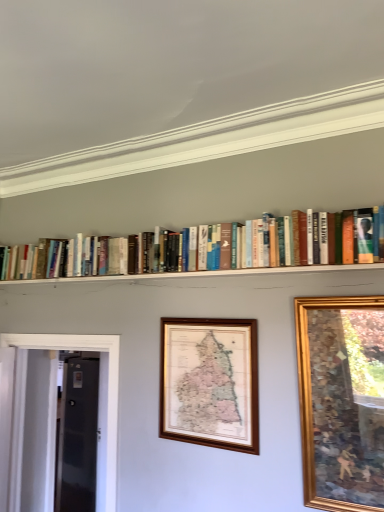
Question: Is transparent glass door at left further to the viewer compared to hardcover books at upper center?

Choices:
 (A) yes
 (B) no

Answer: (A)

Question: Is transparent glass door at left positioned beyond the bounds of hardcover books at upper center?

Choices:
 (A) no
 (B) yes

Answer: (B)

Question: From the image's perspective, is transparent glass door at left on hardcover books at upper center?

Choices:
 (A) yes
 (B) no

Answer: (B)

Question: Does transparent glass door at left have a lesser width compared to hardcover books at upper center?

Choices:
 (A) yes
 (B) no

Answer: (A)

Question: Would you say hardcover books at upper center is part of transparent glass door at left's contents?

Choices:
 (A) no
 (B) yes

Answer: (A)

Question: From a real-world perspective, is wooden map at center, marked as the 1th picture frame in a back-to-front arrangement, physically located above or below gold wooden picture frame at upper right, the 1th picture frame positioned from the right?

Choices:
 (A) above
 (B) below

Answer: (A)

Question: From the image's perspective, relative to gold wooden picture frame at upper right, which is the first picture frame in front-to-back order, is wooden map at center, marked as the 1th picture frame in a back-to-front arrangement, above or below?

Choices:
 (A) above
 (B) below

Answer: (B)

Question: Is wooden map at center, which is the 2th picture frame from front to back, in front of or behind gold wooden picture frame at upper right, which is the first picture frame in front-to-back order, in the image?

Choices:
 (A) front
 (B) behind

Answer: (B)

Question: Considering the positions of wooden map at center, the 2th picture frame in the right-to-left sequence, and gold wooden picture frame at upper right, the 1th picture frame positioned from the right, in the image, is wooden map at center, the 2th picture frame in the right-to-left sequence, wider or thinner than gold wooden picture frame at upper right, the 1th picture frame positioned from the right,?

Choices:
 (A) thin
 (B) wide

Answer: (A)

Question: From a real-world perspective, is hardcover books at upper center positioned above or below transparent glass door at left?

Choices:
 (A) below
 (B) above

Answer: (B)

Question: Is hardcover books at upper center wider or thinner than transparent glass door at left?

Choices:
 (A) wide
 (B) thin

Answer: (A)

Question: From the image's perspective, is hardcover books at upper center positioned above or below transparent glass door at left?

Choices:
 (A) below
 (B) above

Answer: (B)

Question: Considering the positions of hardcover books at upper center and transparent glass door at left in the image, is hardcover books at upper center bigger or smaller than transparent glass door at left?

Choices:
 (A) big
 (B) small

Answer: (A)

Question: Considering the positions of hardcover books at upper center and gold wooden picture frame at upper right, which is the first picture frame in front-to-back order, in the image, is hardcover books at upper center taller or shorter than gold wooden picture frame at upper right, which is the first picture frame in front-to-back order,?

Choices:
 (A) tall
 (B) short

Answer: (B)

Question: Is hardcover books at upper center situated inside gold wooden picture frame at upper right, which ranks as the 2th picture frame in left-to-right order, or outside?

Choices:
 (A) inside
 (B) outside

Answer: (B)